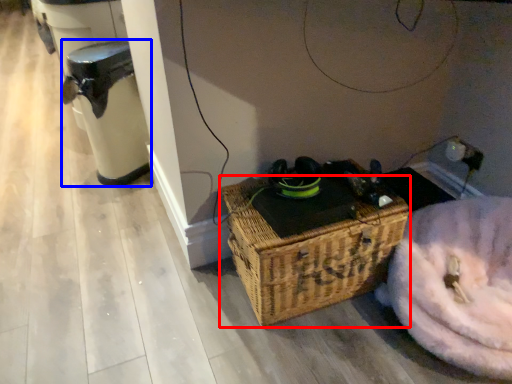
Question: Which object is closer to the camera taking this photo, picnic basket (highlighted by a red box) or water heater (highlighted by a blue box)?

Choices:
 (A) picnic basket
 (B) water heater

Answer: (A)